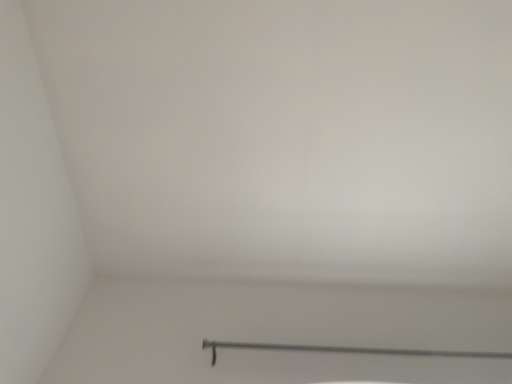
Describe the element at coordinates (347, 350) in the screenshot. I see `silver metallic towel rack at lower center` at that location.

Identify the location of silver metallic towel rack at lower center. (347, 350).

I want to click on silver metallic towel rack at lower center, so (x=347, y=350).